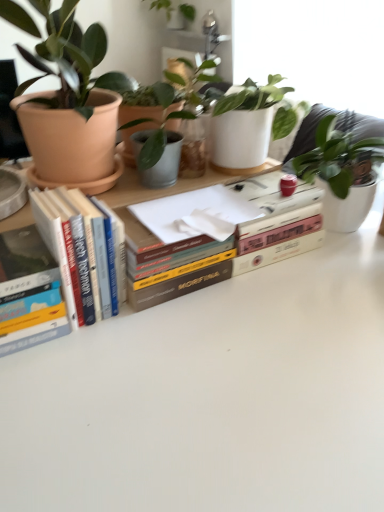
Where is `hardcover books at left, the 2th book from the right`? hardcover books at left, the 2th book from the right is located at coordinates (93, 249).

Measure the distance between hardcover books at left, the 2th book from the right, and camera.

hardcover books at left, the 2th book from the right, and camera are 24.31 inches apart from each other.

Measure the distance between matte terracotta pot at left, positioned as the 3th houseplant in back-to-front order, and camera.

matte terracotta pot at left, positioned as the 3th houseplant in back-to-front order, and camera are 64.50 centimeters apart from each other.

Describe the element at coordinates (170, 109) in the screenshot. I see `matte terracotta pot at upper left, which is the first houseplant in bottom-to-top order` at that location.

Find the location of a particular element. hardcover book at left, the third book in the right-to-left sequence is located at coordinates (29, 292).

Can you confirm if hardcover book at left, the 1th book positioned from the left, is positioned to the right of matte terracotta pot at upper left, arranged as the 3th houseplant when viewed from the top?

No.

Which is in front, point (38, 276) or point (158, 127)?

The point (38, 276) is in front.

Is hardcover book at left, the third book in the right-to-left sequence, next to matte terracotta pot at upper left, which is the 2th houseplant from front to back?

hardcover book at left, the third book in the right-to-left sequence, and matte terracotta pot at upper left, which is the 2th houseplant from front to back, are clearly separated.

From a real-world perspective, is hardcover book at left, the 1th book positioned from the left, physically located above or below hardcover book at center, marked as the 1th book in a right-to-left arrangement?

hardcover book at left, the 1th book positioned from the left, is above hardcover book at center, marked as the 1th book in a right-to-left arrangement.

From the image's perspective, which object appears higher, hardcover book at left, the 1th book positioned from the left, or hardcover book at center, the third book in the left-to-right sequence?

hardcover book at center, the third book in the left-to-right sequence, is shown above in the image.

Between point (4, 326) and point (229, 252), which one is positioned in front?

The point (4, 326) is closer to the camera.

What's the angular difference between hardcover book at left, the third book in the right-to-left sequence, and green matte plant at upper center, which is counted as the 1th houseplant, starting from the top,'s facing directions?

88.9 degrees separate the facing orientations of hardcover book at left, the third book in the right-to-left sequence, and green matte plant at upper center, which is counted as the 1th houseplant, starting from the top.

Does hardcover book at left, the 1th book positioned from the left, come in front of green matte plant at upper center, positioned as the 1th houseplant in back-to-front order?

That is True.

You are a GUI agent. You are given a task and a screenshot of the screen. Output one action in this format:
    pyautogui.click(x=<x>, y=<y>)
    Task: Click on the 2nd book counting from the left of the green matte plant at upper center, which is counted as the 1th houseplant, starting from the top
    The image size is (384, 512).
    Given the screenshot: What is the action you would take?
    pyautogui.click(x=29, y=292)

From the picture: From a real-world perspective, who is located higher, matte terracotta pot at left, the second houseplant in the top-to-bottom sequence, or green matte plant at upper center, which is the 3th houseplant in front-to-back order?

In real-world perspective, green matte plant at upper center, which is the 3th houseplant in front-to-back order, is above.

Is matte terracotta pot at left, the second houseplant in the top-to-bottom sequence, positioned before green matte plant at upper center, positioned as the 1th houseplant in back-to-front order?

Yes, it is in front of green matte plant at upper center, positioned as the 1th houseplant in back-to-front order.

Considering the relative sizes of matte terracotta pot at left, the second houseplant in the top-to-bottom sequence, and green matte plant at upper center, which is the 3th houseplant in front-to-back order, in the image provided, is matte terracotta pot at left, the second houseplant in the top-to-bottom sequence, taller than green matte plant at upper center, which is the 3th houseplant in front-to-back order,?

Yes.

From the image's perspective, is matte terracotta pot at left, which is counted as the 1th houseplant, starting from the front, located above or below green matte plant at upper center, the 3th houseplant positioned from the bottom?

From the image's perspective, matte terracotta pot at left, which is counted as the 1th houseplant, starting from the front, appears below green matte plant at upper center, the 3th houseplant positioned from the bottom.

From a real-world perspective, between matte terracotta pot at upper left, which is the first houseplant in bottom-to-top order, and matte terracotta pot at left, the second houseplant in the top-to-bottom sequence, who is vertically lower?

→ matte terracotta pot at upper left, which is the first houseplant in bottom-to-top order, from a real-world perspective.

How different are the orientations of matte terracotta pot at upper left, which is the 2th houseplant from front to back, and matte terracotta pot at left, the second houseplant positioned from the bottom, in degrees?

89.7 degrees separate the facing orientations of matte terracotta pot at upper left, which is the 2th houseplant from front to back, and matte terracotta pot at left, the second houseplant positioned from the bottom.

Considering the sizes of objects matte terracotta pot at upper left, which is the first houseplant in bottom-to-top order, and matte terracotta pot at left, the second houseplant positioned from the bottom, in the image provided, who is thinner, matte terracotta pot at upper left, which is the first houseplant in bottom-to-top order, or matte terracotta pot at left, the second houseplant positioned from the bottom,?

With smaller width is matte terracotta pot at upper left, which is the first houseplant in bottom-to-top order.

From the picture: Is matte terracotta pot at upper left, which is the first houseplant in bottom-to-top order, inside the boundaries of matte terracotta pot at left, positioned as the 3th houseplant in back-to-front order, or outside?

matte terracotta pot at upper left, which is the first houseplant in bottom-to-top order, is spatially situated outside matte terracotta pot at left, positioned as the 3th houseplant in back-to-front order.

In terms of width, does matte terracotta pot at left, positioned as the 3th houseplant in back-to-front order, look wider or thinner when compared to hardcover books at left, acting as the second book starting from the left?

In the image, matte terracotta pot at left, positioned as the 3th houseplant in back-to-front order, appears to be wider than hardcover books at left, acting as the second book starting from the left.

Is matte terracotta pot at left, the second houseplant in the top-to-bottom sequence, inside the boundaries of hardcover books at left, acting as the second book starting from the left, or outside?

matte terracotta pot at left, the second houseplant in the top-to-bottom sequence, cannot be found inside hardcover books at left, acting as the second book starting from the left.

From the picture: From the image's perspective, is matte terracotta pot at left, which is counted as the 1th houseplant, starting from the front, located above or below hardcover books at left, acting as the second book starting from the left?

From the image's perspective, matte terracotta pot at left, which is counted as the 1th houseplant, starting from the front, appears above hardcover books at left, acting as the second book starting from the left.

Image resolution: width=384 pixels, height=512 pixels. Find the location of `book that is the 2nd object located below the matte terracotta pot at left, positioned as the 3th houseplant in back-to-front order (from the image's perspective)`. book that is the 2nd object located below the matte terracotta pot at left, positioned as the 3th houseplant in back-to-front order (from the image's perspective) is located at coordinates (93, 249).

From a real-world perspective, which is physically above, matte terracotta pot at upper left, which is counted as the 2th houseplant, starting from the back, or hardcover books at left, acting as the second book starting from the left?

matte terracotta pot at upper left, which is counted as the 2th houseplant, starting from the back, is physically above.

Between matte terracotta pot at upper left, which is the first houseplant in bottom-to-top order, and hardcover books at left, the 2th book from the right, which one appears on the right side from the viewer's perspective?

Positioned to the right is matte terracotta pot at upper left, which is the first houseplant in bottom-to-top order.

Measure the distance from matte terracotta pot at upper left, arranged as the 3th houseplant when viewed from the top, to hardcover books at left, the 2th book from the right.

10.12 inches.

From the image's perspective, is matte terracotta pot at upper left, which is the 2th houseplant from front to back, over hardcover books at left, acting as the second book starting from the left?

Yes, from the image's perspective, matte terracotta pot at upper left, which is the 2th houseplant from front to back, is on top of hardcover books at left, acting as the second book starting from the left.

At what (x,y) coordinates should I click in order to perform the action: click on the 3rd houseplant counting from the right of the hardcover book at left, the 1th book positioned from the left. Please return your answer as a coordinate pair (x, y). Image resolution: width=384 pixels, height=512 pixels. Looking at the image, I should click on (170, 109).

You are a GUI agent. You are given a task and a screenshot of the screen. Output one action in this format:
    pyautogui.click(x=<x>, y=<y>)
    Task: Click on the 1st book directly above the hardcover book at center, the third book in the left-to-right sequence (from a real-world perspective)
    The height and width of the screenshot is (512, 384).
    Given the screenshot: What is the action you would take?
    pyautogui.click(x=29, y=292)

When comparing their distances from matte terracotta pot at left, the second houseplant in the top-to-bottom sequence, does green matte plant at upper center, which is the 3th houseplant in front-to-back order, or hardcover books at left, acting as the second book starting from the left, seem closer?

The object closer to matte terracotta pot at left, the second houseplant in the top-to-bottom sequence, is hardcover books at left, acting as the second book starting from the left.

Considering their positions, is hardcover book at left, the third book in the right-to-left sequence, positioned closer to green matte plant at upper center, which is counted as the 1th houseplant, starting from the top, than hardcover books at left, acting as the second book starting from the left?

hardcover books at left, acting as the second book starting from the left.

When comparing their distances from hardcover books at left, acting as the second book starting from the left, does matte terracotta pot at upper left, arranged as the 3th houseplant when viewed from the top, or hardcover book at center, marked as the 1th book in a right-to-left arrangement, seem further?

Among the two, matte terracotta pot at upper left, arranged as the 3th houseplant when viewed from the top, is located further to hardcover books at left, acting as the second book starting from the left.

Considering their positions, is green matte plant at upper center, which is counted as the 1th houseplant, starting from the top, positioned closer to matte terracotta pot at left, the second houseplant positioned from the bottom, than hardcover book at center, marked as the 1th book in a right-to-left arrangement?

hardcover book at center, marked as the 1th book in a right-to-left arrangement, is positioned closer to the anchor matte terracotta pot at left, the second houseplant positioned from the bottom.

Which object lies nearer to the anchor point hardcover books at left, the 2th book from the right, matte terracotta pot at upper left, arranged as the 3th houseplant when viewed from the top, or hardcover book at left, the third book in the right-to-left sequence?

Based on the image, hardcover book at left, the third book in the right-to-left sequence, appears to be nearer to hardcover books at left, the 2th book from the right.

From the image, which object appears to be farther from hardcover book at left, the 1th book positioned from the left, matte terracotta pot at upper left, which is the first houseplant in bottom-to-top order, or hardcover book at center, the third book in the left-to-right sequence?

matte terracotta pot at upper left, which is the first houseplant in bottom-to-top order, is further to hardcover book at left, the 1th book positioned from the left.

Estimate the real-world distances between objects in this image. Which object is closer to matte terracotta pot at upper left, which is the first houseplant in bottom-to-top order, green matte plant at upper center, the 3th houseplant positioned from the bottom, or matte terracotta pot at left, which is counted as the 1th houseplant, starting from the front?

Based on the image, matte terracotta pot at left, which is counted as the 1th houseplant, starting from the front, appears to be nearer to matte terracotta pot at upper left, which is the first houseplant in bottom-to-top order.

Looking at the image, which one is located closer to matte terracotta pot at left, the second houseplant in the top-to-bottom sequence, green matte plant at upper center, positioned as the 1th houseplant in back-to-front order, or hardcover book at left, the third book in the right-to-left sequence?

hardcover book at left, the third book in the right-to-left sequence, is closer to matte terracotta pot at left, the second houseplant in the top-to-bottom sequence.

The height and width of the screenshot is (512, 384). I want to click on book located between hardcover books at left, the 2th book from the right, and green matte plant at upper center, which is the 3th houseplant in front-to-back order, in the depth direction, so click(242, 244).

The height and width of the screenshot is (512, 384). What are the coordinates of `houseplant between hardcover book at center, marked as the 1th book in a right-to-left arrangement, and green matte plant at upper center, which is counted as the 1th houseplant, starting from the top, along the z-axis` in the screenshot? It's located at (170, 109).

This screenshot has width=384, height=512. Find the location of `houseplant between matte terracotta pot at left, the second houseplant in the top-to-bottom sequence, and green matte plant at upper center, positioned as the 1th houseplant in back-to-front order, in the front-back direction`. houseplant between matte terracotta pot at left, the second houseplant in the top-to-bottom sequence, and green matte plant at upper center, positioned as the 1th houseplant in back-to-front order, in the front-back direction is located at coordinates (170, 109).

Image resolution: width=384 pixels, height=512 pixels. I want to click on book situated between hardcover book at left, the 1th book positioned from the left, and hardcover book at center, the third book in the left-to-right sequence, from left to right, so click(x=93, y=249).